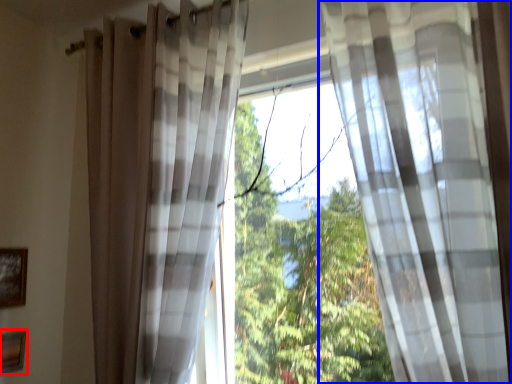
Question: Among these objects, which one is farthest to the camera, picture frame (highlighted by a red box) or curtain (highlighted by a blue box)?

Choices:
 (A) picture frame
 (B) curtain

Answer: (A)